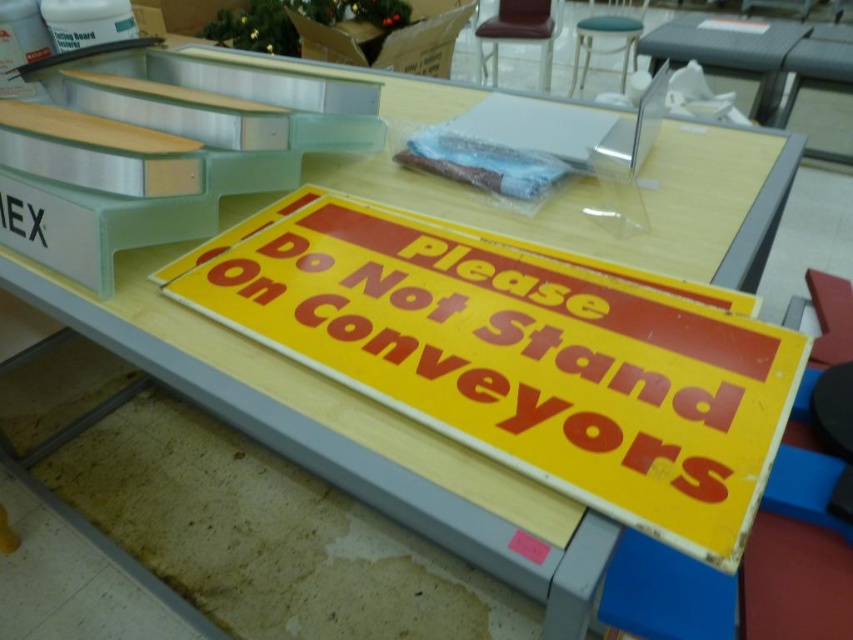
Question: Can you confirm if clear plastic table at upper right is thinner than metallic silver stool at upper center?

Choices:
 (A) yes
 (B) no

Answer: (B)

Question: Which object appears farthest from the camera in this image?

Choices:
 (A) clear plastic table at upper right
 (B) metallic silver stool at upper center

Answer: (B)

Question: Among these points, which one is farthest from the camera?

Choices:
 (A) (582, 74)
 (B) (790, 28)

Answer: (A)

Question: Is clear plastic table at upper right closer to camera compared to metallic silver stool at upper center?

Choices:
 (A) no
 (B) yes

Answer: (B)

Question: Is the position of clear plastic table at upper right more distant than that of metallic silver stool at upper center?

Choices:
 (A) yes
 (B) no

Answer: (B)

Question: Which point is farther to the camera?

Choices:
 (A) (592, 45)
 (B) (793, 29)

Answer: (A)